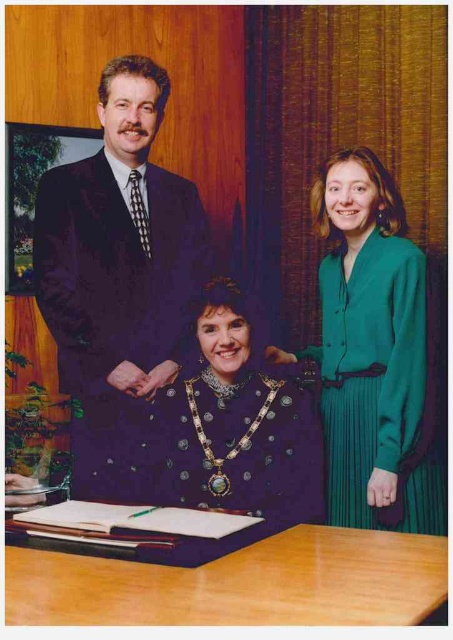
Can you confirm if dark suit at center is wider than purple velvet dress at center?

Indeed, dark suit at center has a greater width compared to purple velvet dress at center.

Does dark suit at center appear on the left side of purple velvet dress at center?

In fact, dark suit at center is to the right of purple velvet dress at center.

Is point (110, 156) closer to viewer compared to point (58, 243)?

No, it is behind (58, 243).

Locate an element on the screen. The height and width of the screenshot is (640, 453). dark suit at center is located at coordinates (119, 276).

Describe the element at coordinates (374, 355) in the screenshot. I see `green silk blouse at right` at that location.

Is green silk blouse at right thinner than light brown wooden table at lower center?

Correct, green silk blouse at right's width is less than light brown wooden table at lower center's.

This screenshot has height=640, width=453. What do you see at coordinates (374, 355) in the screenshot?
I see `green silk blouse at right` at bounding box center [374, 355].

Image resolution: width=453 pixels, height=640 pixels. I want to click on green silk blouse at right, so click(x=374, y=355).

Find the location of a particular element. The image size is (453, 640). purple velvet dress at center is located at coordinates (119, 248).

Can you confirm if purple velvet dress at center is shorter than green silk blouse at right?

No.

Between point (157, 125) and point (357, 385), which one is positioned in front?

Point (357, 385)

Where is `purple velvet dress at center`? purple velvet dress at center is located at coordinates (119, 248).